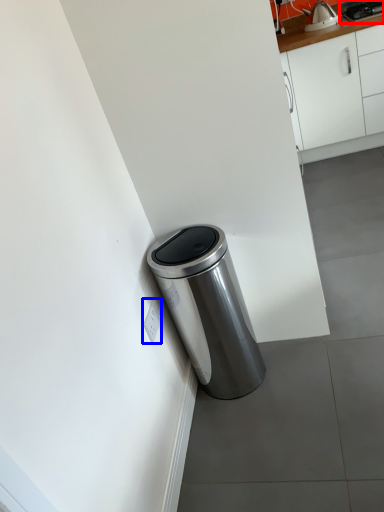
Question: Which object appears farthest to the camera in this image, appliance (highlighted by a red box) or electric outlet (highlighted by a blue box)?

Choices:
 (A) appliance
 (B) electric outlet

Answer: (A)